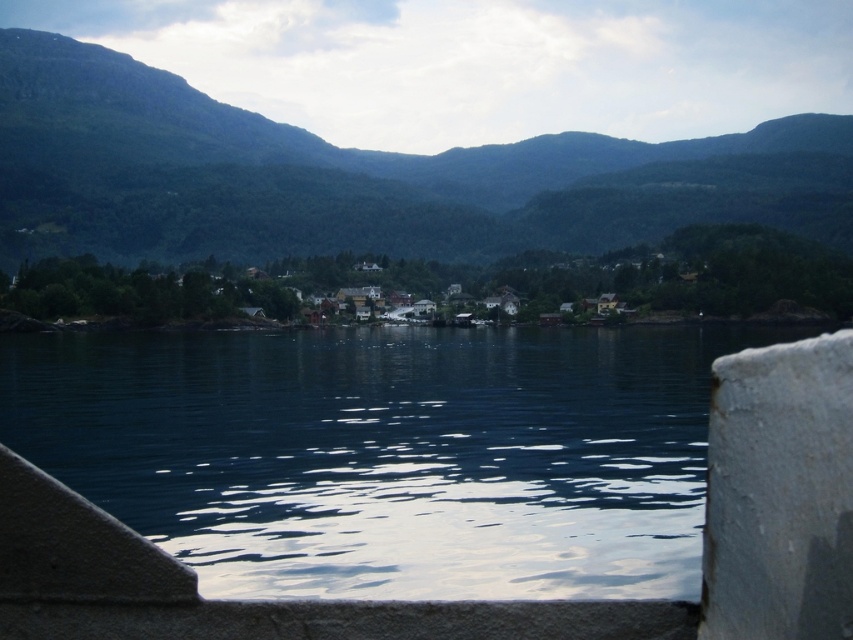
You are a hiker who wants to take a photo of the dark blue water at center and the green forested mountain at upper center. Which object should you position lower in your camera frame to capture both in the shot?

To capture both the dark blue water at center and the green forested mountain at upper center in your photo, you should position the dark blue water at center lower in your camera frame since it is located below the green forested mountain at upper center.

You are standing at the edge of the dark blue water at center and want to reach the green forested mountain at upper center. Which direction should you head to get closer to the mountain?

To get closer to the green forested mountain at upper center, you should head away from the dark blue water at center since the mountain is further away from the viewer compared to the water.

From the picture: You are a photographer planning to capture the dark blue water at center and the green forested mountain at upper center in a single frame. Based on their sizes, which object should you focus on first to ensure both are clearly visible in your photo?

The dark blue water at center has a smaller size compared to green forested mountain at upper center. To ensure both are clearly visible, focus on the dark blue water at center first since it is smaller and requires more attention to detail.